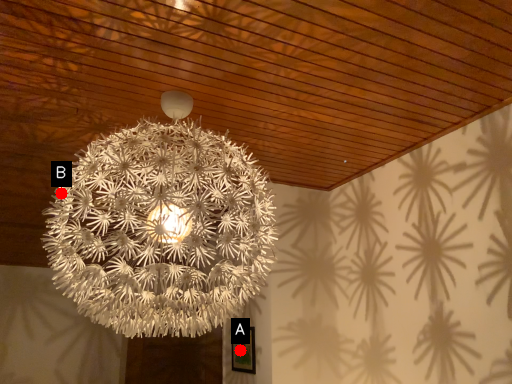
Question: Two points are circled on the image, labeled by A and B beside each circle. Among these points, which one is nearest to the camera?

Choices:
 (A) A is closer
 (B) B is closer

Answer: (B)